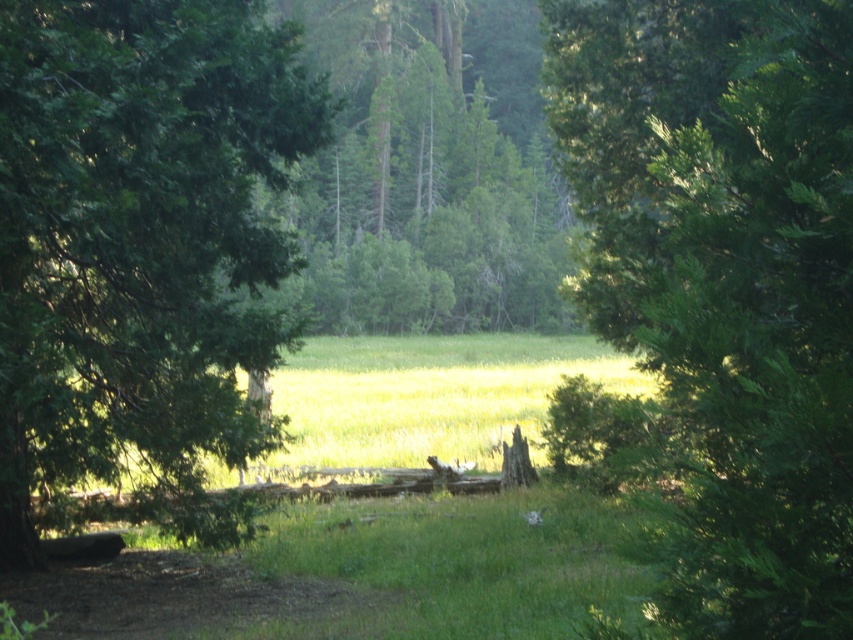
Consider the image. Can you confirm if green needle-like at center is positioned below green textured tree at center?

Indeed, green needle-like at center is positioned under green textured tree at center.

Is green needle-like at center closer to the viewer compared to green textured tree at center?

Yes, it is.

Measure the distance between green needle-like at center and camera.

The distance of green needle-like at center from camera is 3.28 meters.

Identify the location of green needle-like at center. This screenshot has width=853, height=640. (717, 296).

Which is more to the left, green needle-like at center or green leafy tree at left?

green leafy tree at left

I want to click on green needle-like at center, so click(x=717, y=296).

Image resolution: width=853 pixels, height=640 pixels. What are the coordinates of `green needle-like at center` in the screenshot? It's located at (x=717, y=296).

Is green leafy tree at left below green textured tree at center?

Yes.

Is green leafy tree at left positioned at the back of green textured tree at center?

No.

Which is behind, point (74, 483) or point (422, 100)?

Point (422, 100)

Locate an element on the screen. The width and height of the screenshot is (853, 640). green leafy tree at left is located at coordinates (141, 253).